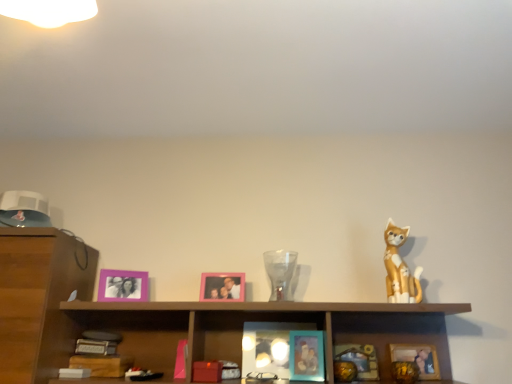
Question: Is wooden cabinet at center at the right side of teal matte picture frame at lower center, marked as the 2th picture frame in a right-to-left arrangement?

Choices:
 (A) no
 (B) yes

Answer: (A)

Question: Is teal matte picture frame at lower center, which is counted as the 4th picture frame, starting from the left, inside wooden cabinet at center?

Choices:
 (A) no
 (B) yes

Answer: (B)

Question: From a real-world perspective, is wooden cabinet at center under teal matte picture frame at lower center, marked as the 2th picture frame in a right-to-left arrangement?

Choices:
 (A) yes
 (B) no

Answer: (B)

Question: Can you confirm if wooden cabinet at center is taller than teal matte picture frame at lower center, which is counted as the 4th picture frame, starting from the left?

Choices:
 (A) yes
 (B) no

Answer: (A)

Question: Considering the relative sizes of wooden cabinet at center and teal matte picture frame at lower center, which is counted as the 4th picture frame, starting from the left, in the image provided, is wooden cabinet at center shorter than teal matte picture frame at lower center, which is counted as the 4th picture frame, starting from the left,?

Choices:
 (A) yes
 (B) no

Answer: (B)

Question: Is point (216, 279) closer or farther from the camera than point (287, 253)?

Choices:
 (A) farther
 (B) closer

Answer: (B)

Question: From a real-world perspective, is pink matte picture frame at center, which is counted as the fourth picture frame, starting from the right, positioned above or below transparent glass vase at center?

Choices:
 (A) below
 (B) above

Answer: (A)

Question: Relative to transparent glass vase at center, is pink matte picture frame at center, acting as the 2th picture frame starting from the left, in front or behind?

Choices:
 (A) front
 (B) behind

Answer: (B)

Question: Is pink matte picture frame at center, acting as the 2th picture frame starting from the left, inside the boundaries of transparent glass vase at center, or outside?

Choices:
 (A) outside
 (B) inside

Answer: (A)

Question: From the image's perspective, is purple matte picture frame at upper left, arranged as the first picture frame when viewed from the left, located above or below teal glossy picture frame at center, positioned as the third picture frame in left-to-right order?

Choices:
 (A) below
 (B) above

Answer: (B)

Question: Is purple matte picture frame at upper left, arranged as the first picture frame when viewed from the left, inside the boundaries of teal glossy picture frame at center, positioned as the third picture frame in left-to-right order, or outside?

Choices:
 (A) outside
 (B) inside

Answer: (A)

Question: From a real-world perspective, is purple matte picture frame at upper left, the fifth picture frame positioned from the right, positioned above or below teal glossy picture frame at center, positioned as the third picture frame in left-to-right order?

Choices:
 (A) below
 (B) above

Answer: (B)

Question: Would you say purple matte picture frame at upper left, arranged as the first picture frame when viewed from the left, is to the left or to the right of teal glossy picture frame at center, positioned as the third picture frame in left-to-right order, in the picture?

Choices:
 (A) left
 (B) right

Answer: (A)

Question: From the image's perspective, relative to transparent glass vase at center, is purple matte picture frame at upper left, the fifth picture frame positioned from the right, above or below?

Choices:
 (A) above
 (B) below

Answer: (B)

Question: Do you think purple matte picture frame at upper left, the fifth picture frame positioned from the right, is within transparent glass vase at center, or outside of it?

Choices:
 (A) inside
 (B) outside

Answer: (B)